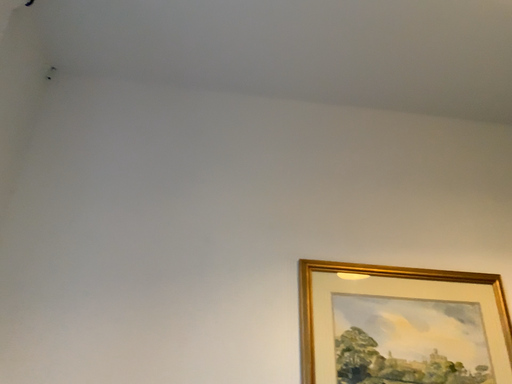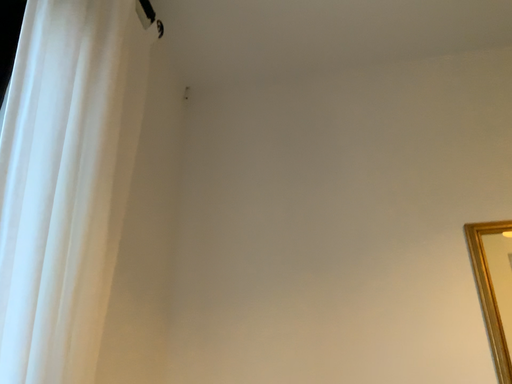
Question: How did the camera likely rotate when shooting the video?

Choices:
 (A) rotated left
 (B) rotated right

Answer: (A)